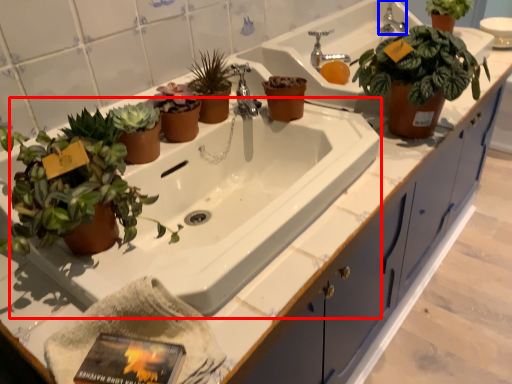
Question: Among these objects, which one is farthest to the camera, bath (highlighted by a red box) or faucet (highlighted by a blue box)?

Choices:
 (A) bath
 (B) faucet

Answer: (B)